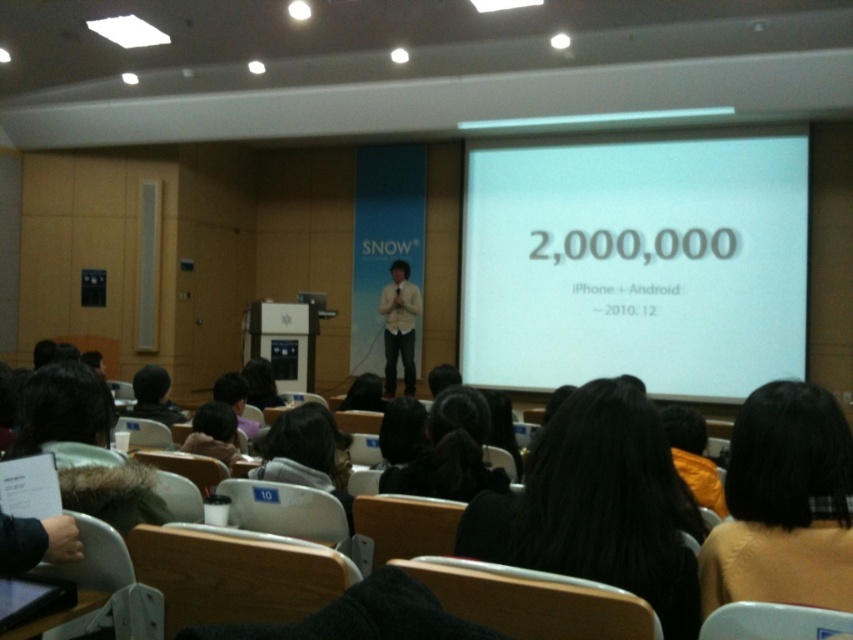
Question: Does light brown sweater at lower right lie behind light beige shirt at center?

Choices:
 (A) no
 (B) yes

Answer: (A)

Question: Which object is farther from the camera taking this photo?

Choices:
 (A) light beige shirt at center
 (B) white matte projection screen at center

Answer: (A)

Question: Which object is positioned closest to the black hair at center?

Choices:
 (A) light brown sweater at lower right
 (B) white matte projection screen at center

Answer: (A)

Question: Which object appears closest to the camera in this image?

Choices:
 (A) black hair at center
 (B) white matte projection screen at center
 (C) light brown sweater at lower right
 (D) light beige shirt at center

Answer: (A)

Question: Can you confirm if white matte projection screen at center is wider than black hair at center?

Choices:
 (A) yes
 (B) no

Answer: (A)

Question: Is white matte projection screen at center thinner than light brown sweater at lower right?

Choices:
 (A) yes
 (B) no

Answer: (B)